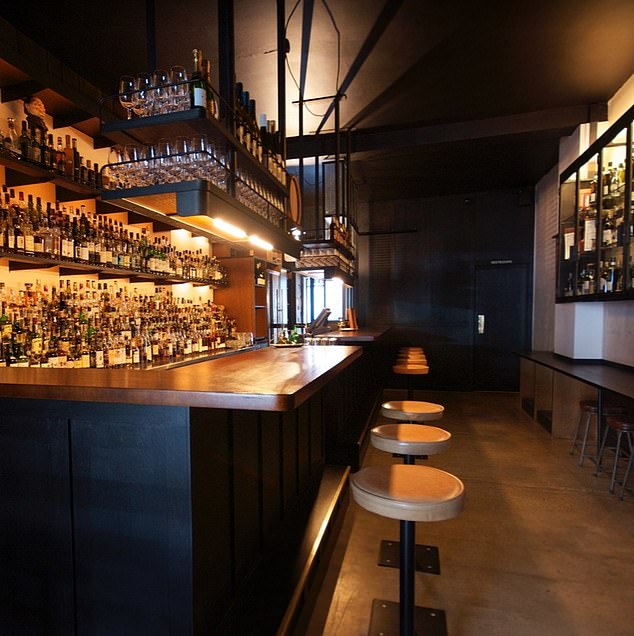
Locate an element on the screen. This screenshot has height=636, width=634. bar counter is located at coordinates (61, 375), (281, 378), (358, 332).